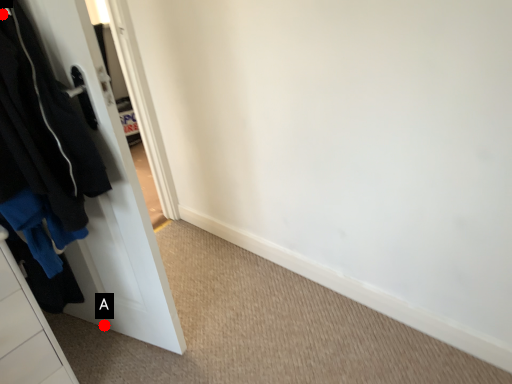
Question: Two points are circled on the image, labeled by A and B beside each circle. Which point is closer to the camera taking this photo?

Choices:
 (A) A is closer
 (B) B is closer

Answer: (B)